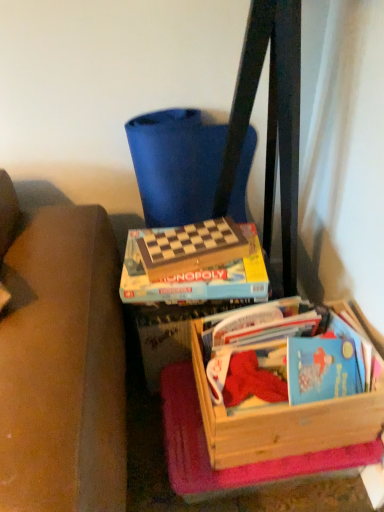
This screenshot has height=512, width=384. What do you see at coordinates (176, 165) in the screenshot?
I see `blue fabric folding chair at upper center` at bounding box center [176, 165].

Locate an element on the screen. Image resolution: width=384 pixels, height=512 pixels. wooden crate at lower right is located at coordinates (282, 421).

Between point (149, 177) and point (186, 236), which one is positioned behind?

The point (149, 177) is more distant.

Considering the relative positions of blue fabric folding chair at upper center and wooden paperback book at center in the image provided, is blue fabric folding chair at upper center behind wooden paperback book at center?

Yes, it is.

From the image's perspective, which is below, blue fabric folding chair at upper center or wooden paperback book at center?

wooden paperback book at center, from the image's perspective.

From the image's perspective, is wooden crate at lower right above or below wooden paperback book at center?

wooden crate at lower right is below wooden paperback book at center.

Would you consider wooden crate at lower right to be distant from wooden paperback book at center?

That's not correct — wooden crate at lower right is a little close to wooden paperback book at center.

In terms of height, does wooden crate at lower right look taller or shorter compared to wooden paperback book at center?

Clearly, wooden crate at lower right is taller compared to wooden paperback book at center.

How many degrees apart are the facing directions of wooden crate at lower right and wooden paperback book at center?

wooden crate at lower right and wooden paperback book at center are facing 8.47 degrees away from each other.

From a real-world perspective, is wooden crate at lower right located higher than blue fabric folding chair at upper center?

No, from a real-world perspective, wooden crate at lower right is not above blue fabric folding chair at upper center.

Considering the positions of point (214, 463) and point (184, 223), is point (214, 463) closer or farther from the camera than point (184, 223)?

Point (214, 463) is closer to the camera than point (184, 223).

Considering the positions of objects wooden crate at lower right and blue fabric folding chair at upper center in the image provided, who is more to the left, wooden crate at lower right or blue fabric folding chair at upper center?

From the viewer's perspective, blue fabric folding chair at upper center appears more on the left side.

Looking at the image, does wooden crate at lower right seem bigger or smaller compared to blue fabric folding chair at upper center?

In the image, wooden crate at lower right appears to be smaller than blue fabric folding chair at upper center.

Does point (242, 246) appear closer or farther from the camera than point (243, 154)?

Point (242, 246) is closer to the camera than point (243, 154).

Identify the location of folding chair lying above the wooden paperback book at center (from the image's perspective). (176, 165).

From the image's perspective, is wooden paperback book at center below blue fabric folding chair at upper center?

Yes, from the image's perspective, wooden paperback book at center is below blue fabric folding chair at upper center.

Is wooden paperback book at center thinner than blue fabric folding chair at upper center?

Indeed, wooden paperback book at center has a lesser width compared to blue fabric folding chair at upper center.

Between wooden paperback book at center and wooden crate at lower right, which one is positioned in front?

wooden crate at lower right is closer to the camera.

Image resolution: width=384 pixels, height=512 pixels. In order to click on paperback book on the left of wooden crate at lower right in this screenshot , I will do `click(191, 248)`.

Which is more to the right, wooden paperback book at center or wooden crate at lower right?

From the viewer's perspective, wooden crate at lower right appears more on the right side.

Considering the relative sizes of wooden paperback book at center and wooden crate at lower right in the image provided, is wooden paperback book at center taller than wooden crate at lower right?

Incorrect, the height of wooden paperback book at center is not larger of that of wooden crate at lower right.

In the scene shown: Considering the positions of objects blue fabric folding chair at upper center and wooden crate at lower right in the image provided, who is more to the right, blue fabric folding chair at upper center or wooden crate at lower right?

Positioned to the right is wooden crate at lower right.

Where is `box located underneath the blue fabric folding chair at upper center (from a real-world perspective)`? The width and height of the screenshot is (384, 512). box located underneath the blue fabric folding chair at upper center (from a real-world perspective) is located at coordinates (282, 421).

Which point is more forward, [143,119] or [378,432]?

Point [378,432]

Is blue fabric folding chair at upper center positioned beyond the bounds of wooden crate at lower right?

Yes, blue fabric folding chair at upper center is outside of wooden crate at lower right.

Locate an element on the screen. folding chair behind the wooden paperback book at center is located at coordinates (176, 165).

Identify the location of box that appears below the wooden paperback book at center (from a real-world perspective). (282, 421).

From the image, which object appears to be farther from wooden crate at lower right, wooden paperback book at center or blue fabric folding chair at upper center?

Among the two, blue fabric folding chair at upper center is located further to wooden crate at lower right.

Considering their positions, is wooden crate at lower right positioned further to wooden paperback book at center than blue fabric folding chair at upper center?

Based on the image, wooden crate at lower right appears to be further to wooden paperback book at center.

Estimate the real-world distances between objects in this image. Which object is further from wooden crate at lower right, blue fabric folding chair at upper center or wooden paperback book at center?

blue fabric folding chair at upper center.

Estimate the real-world distances between objects in this image. Which object is further from blue fabric folding chair at upper center, wooden crate at lower right or wooden paperback book at center?

wooden crate at lower right lies further to blue fabric folding chair at upper center than the other object.

From the image, which object appears to be nearer to blue fabric folding chair at upper center, wooden paperback book at center or wooden crate at lower right?

Among the two, wooden paperback book at center is located nearer to blue fabric folding chair at upper center.

Considering their positions, is blue fabric folding chair at upper center positioned further to wooden paperback book at center than wooden crate at lower right?

The object further to wooden paperback book at center is wooden crate at lower right.

You are a GUI agent. You are given a task and a screenshot of the screen. Output one action in this format:
    pyautogui.click(x=<x>, y=<y>)
    Task: Click on the paperback book between blue fabric folding chair at upper center and wooden crate at lower right from top to bottom
    
    Given the screenshot: What is the action you would take?
    pyautogui.click(x=191, y=248)